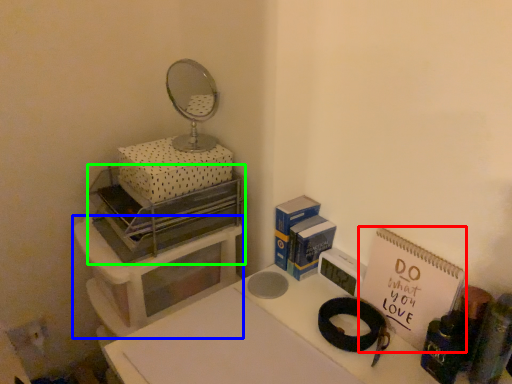
Question: Considering the real-world distances, which object is closest to notebook (highlighted by a red box)? furniture (highlighted by a blue box) or appliance (highlighted by a green box).

Choices:
 (A) furniture
 (B) appliance

Answer: (B)